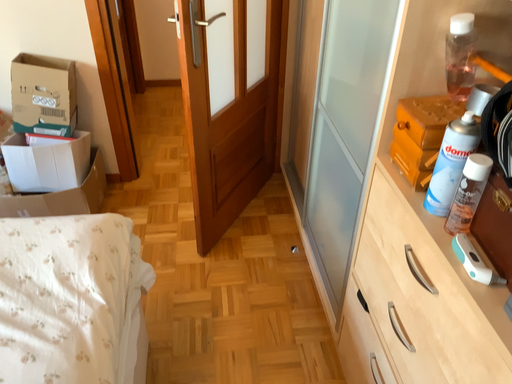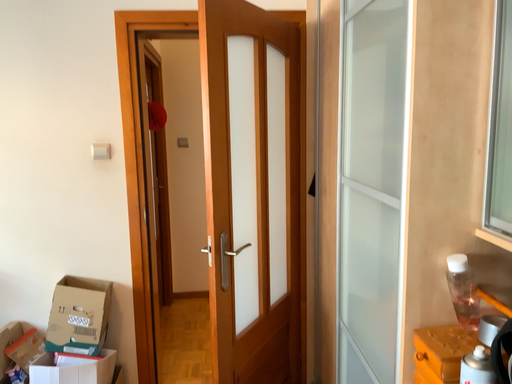
Question: Which way did the camera rotate in the video?

Choices:
 (A) rotated upward
 (B) rotated downward

Answer: (A)